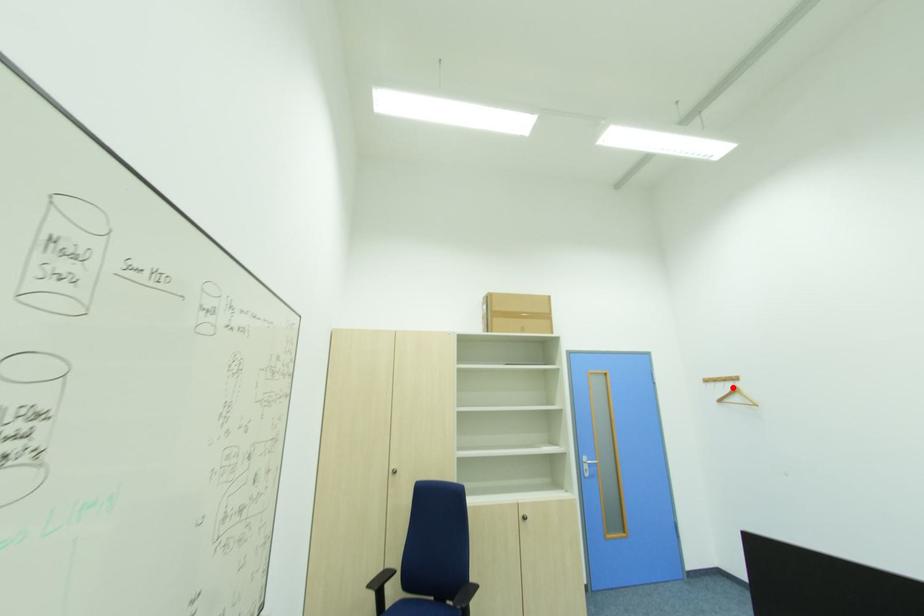
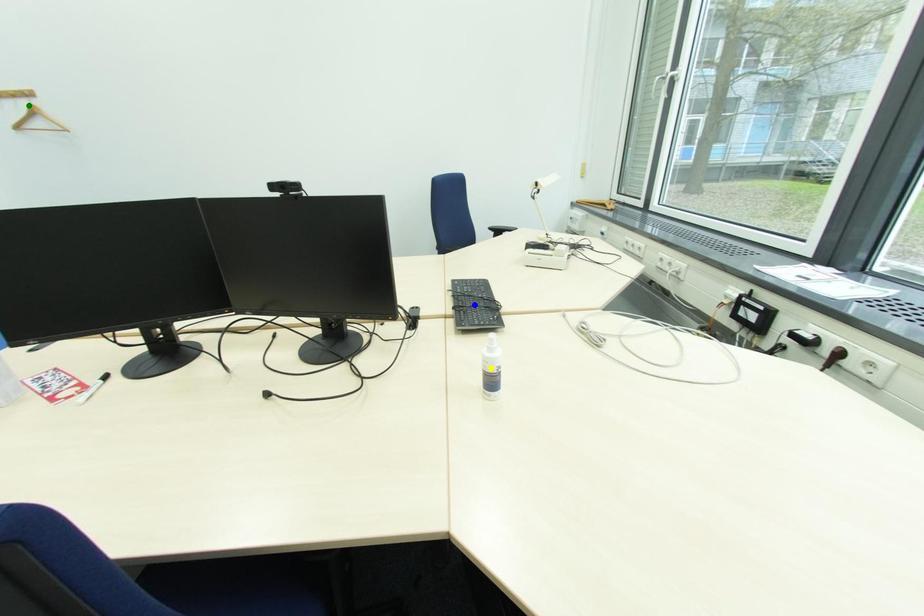
Question: I am providing you with two images of the same scene from different viewpoints. A red point is marked on the first image. You are given multiple points on the second image. In image 2, which mark is for the same physical point as the one in image 1?

Choices:
 (A) blue point
 (B) green point
 (C) yellow point

Answer: (B)